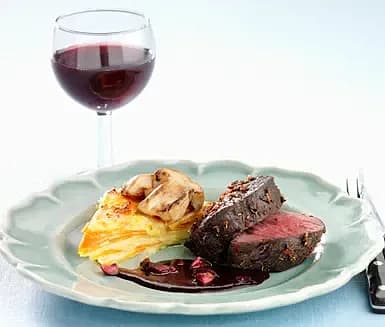
You are a GUI agent. You are given a task and a screenshot of the screen. Output one action in this format:
    pyautogui.click(x=<x>, y=<y>)
    Task: Click on the plate
    This screenshot has width=385, height=327.
    Given the screenshot: What is the action you would take?
    pyautogui.click(x=310, y=279)